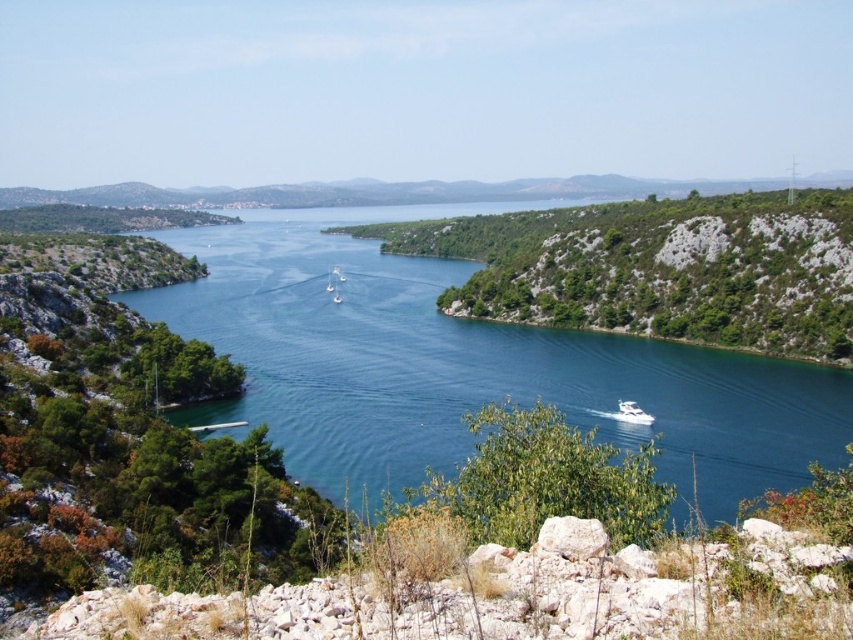
What is the exact coordinate of the clear blue water at center?

The clear blue water at center is located at point (465, 365).

You are standing on the rocky outcrops in the foreground of the coastal landscape. You see the clear blue water at center and the white glossy boat at lower right. Which object is closer to your current position?

The white glossy boat at lower right is closer to your current position because it is located below the clear blue water at center.